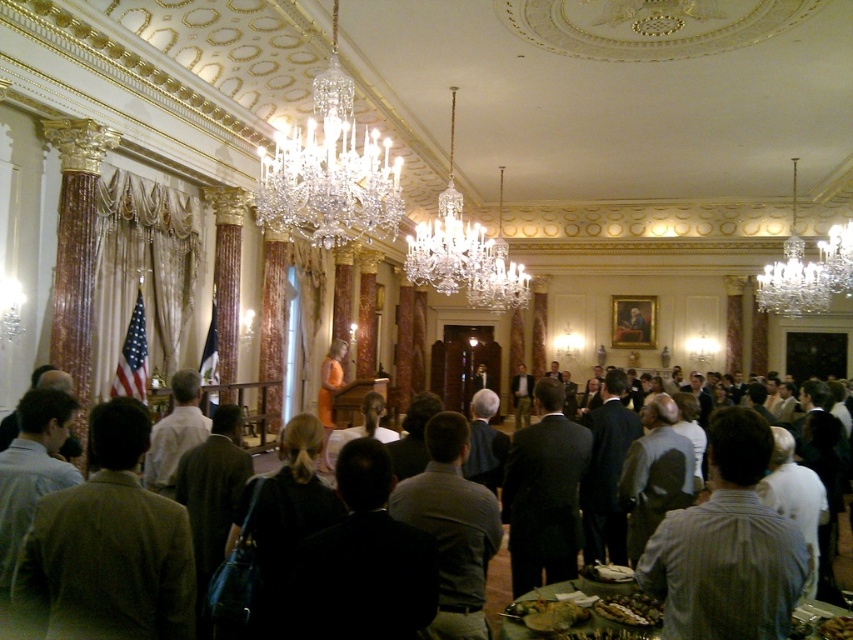
Who is positioned more to the right, dark brown suit at center or shiny brown nuts at lower center?

shiny brown nuts at lower center is more to the right.

Which is below, dark brown suit at center or shiny brown nuts at lower center?

Positioned lower is dark brown suit at center.

The height and width of the screenshot is (640, 853). Find the location of `dark brown suit at center`. dark brown suit at center is located at coordinates (497, 588).